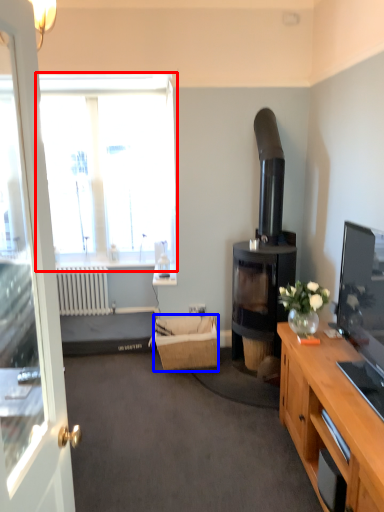
Question: Which of the following is the closest to the observer, window (highlighted by a red box) or picnic basket (highlighted by a blue box)?

Choices:
 (A) window
 (B) picnic basket

Answer: (B)